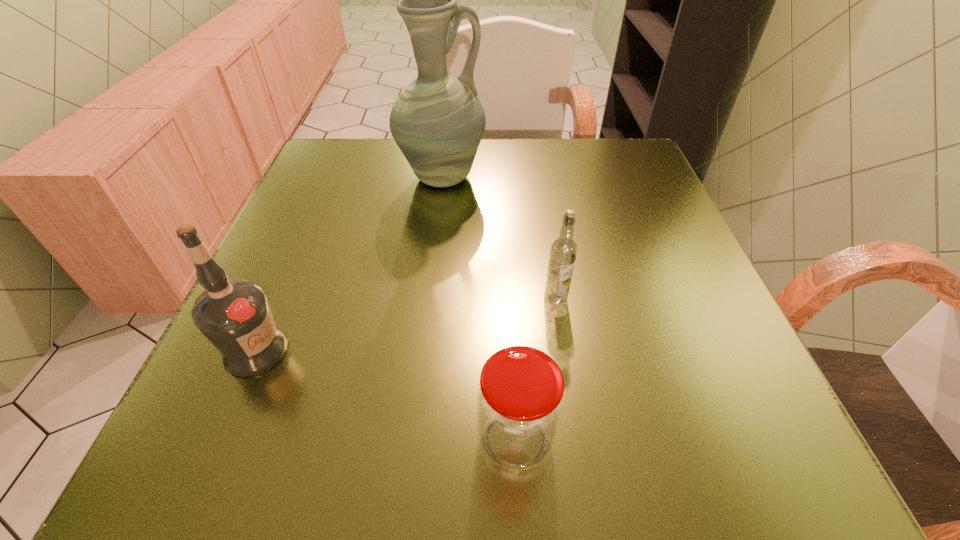
At what (x,y) coordinates should I click in order to perform the action: click on the farthest object. Please return your answer as a coordinate pair (x, y). Image resolution: width=960 pixels, height=540 pixels. Looking at the image, I should click on (437, 121).

I want to click on the tallest object, so click(x=437, y=121).

The width and height of the screenshot is (960, 540). I want to click on the nearer vodka, so click(x=234, y=315).

This screenshot has width=960, height=540. I want to click on the leftmost object, so click(x=234, y=315).

Locate an element on the screen. This screenshot has height=540, width=960. the rightmost object is located at coordinates (563, 252).

Find the location of a particular element. The image size is (960, 540). the right vodka is located at coordinates (563, 252).

The image size is (960, 540). What are the coordinates of `the nearest object` in the screenshot? It's located at (520, 397).

Identify the location of jar. (520, 397).

Locate an element on the screen. blank space located on the handle side of the farthest object is located at coordinates [638, 178].

Find the location of `blank space located 0.230m on the front label of the left vodka`. blank space located 0.230m on the front label of the left vodka is located at coordinates (444, 350).